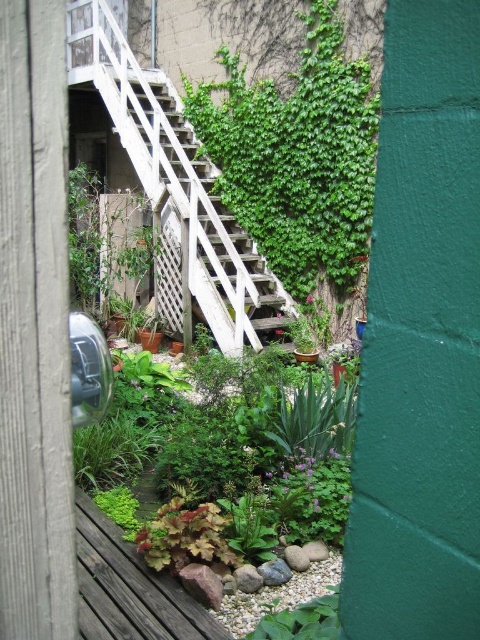
Does wooden stairs at center appear under leathery green leaf at center?

No.

I want to click on wooden stairs at center, so click(x=193, y=208).

Locate an element on the screen. wooden stairs at center is located at coordinates (193, 208).

Is leathery green leaf at center to the left of green leafy plant at lower center from the viewer's perspective?

Yes, leathery green leaf at center is to the left of green leafy plant at lower center.

Can you confirm if leathery green leaf at center is bigger than green leafy plant at lower center?

No, leathery green leaf at center is not bigger than green leafy plant at lower center.

Who is more forward, (x=201, y=547) or (x=325, y=625)?

Point (x=325, y=625)

The width and height of the screenshot is (480, 640). In order to click on leathery green leaf at center in this screenshot , I will do `click(184, 536)`.

Does point (189, 125) come in front of point (300, 620)?

No, (189, 125) is behind (300, 620).

Between wooden stairs at center and green leafy plant at lower center, which one has more height?

Standing taller between the two is wooden stairs at center.

Is point (228, 349) farther from camera compared to point (331, 604)?

Yes.

Image resolution: width=480 pixels, height=640 pixels. I want to click on wooden stairs at center, so click(x=193, y=208).